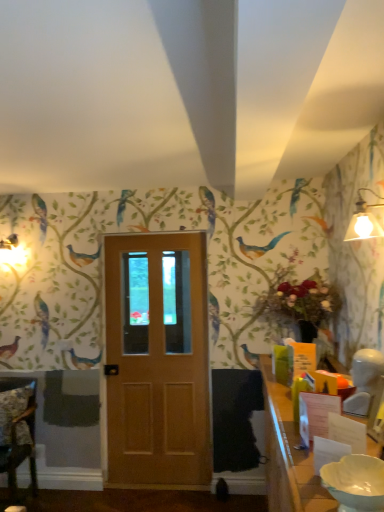
Question: Which is correct: white glossy table at lower right is inside matte white lampshade at upper right, or outside of it?

Choices:
 (A) inside
 (B) outside

Answer: (B)

Question: Looking at their shapes, would you say white glossy table at lower right is wider or thinner than matte white lampshade at upper right?

Choices:
 (A) thin
 (B) wide

Answer: (B)

Question: Which object is positioned closest to the white glossy table at lower right?

Choices:
 (A) matte white lampshade at upper right
 (B) matte wood door at center
 (C) white glossy bowl at lower right
 (D) wooden chair at lower left

Answer: (C)

Question: Which is farther from the white glossy table at lower right?

Choices:
 (A) matte white lampshade at upper right
 (B) matte wood door at center
 (C) white glossy bowl at lower right
 (D) wooden chair at lower left

Answer: (D)